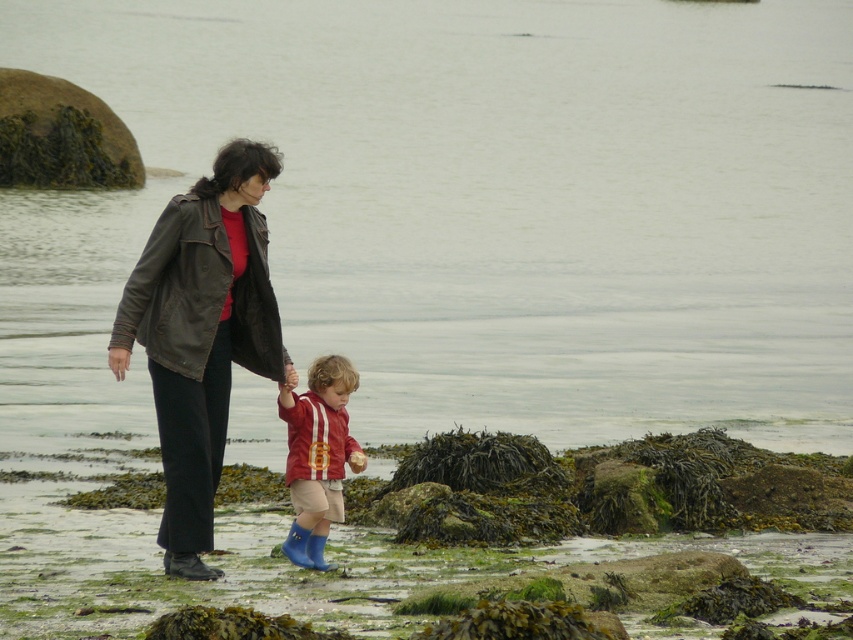
Is leather jacket at center closer to camera compared to rubber blue boots at center?

Yes, it is in front of rubber blue boots at center.

Which is behind, point (213, 173) or point (286, 476)?

The point (213, 173) is more distant.

Which is behind, point (235, 148) or point (312, 368)?

Point (235, 148)

This screenshot has width=853, height=640. I want to click on leather jacket at center, so click(201, 333).

Can you confirm if clear water at center is positioned above rubber blue boots at center?

Indeed, clear water at center is positioned over rubber blue boots at center.

Locate an element on the screen. The image size is (853, 640). clear water at center is located at coordinates (471, 211).

The height and width of the screenshot is (640, 853). What are the coordinates of `clear water at center` in the screenshot? It's located at (471, 211).

Locate an element on the screen. Image resolution: width=853 pixels, height=640 pixels. clear water at center is located at coordinates (471, 211).

Describe the element at coordinates (471, 211) in the screenshot. I see `clear water at center` at that location.

Identify the location of clear water at center. pos(471,211).